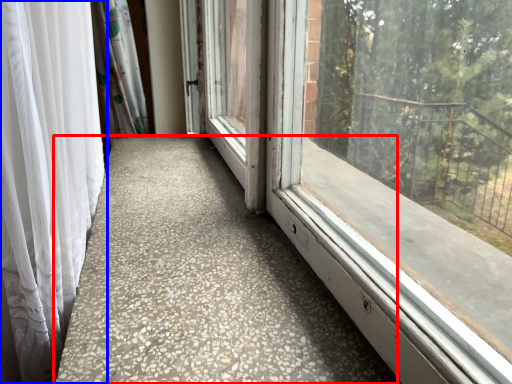
Question: Which object appears closest to the camera in this image, concrete (highlighted by a red box) or curtain (highlighted by a blue box)?

Choices:
 (A) concrete
 (B) curtain

Answer: (B)